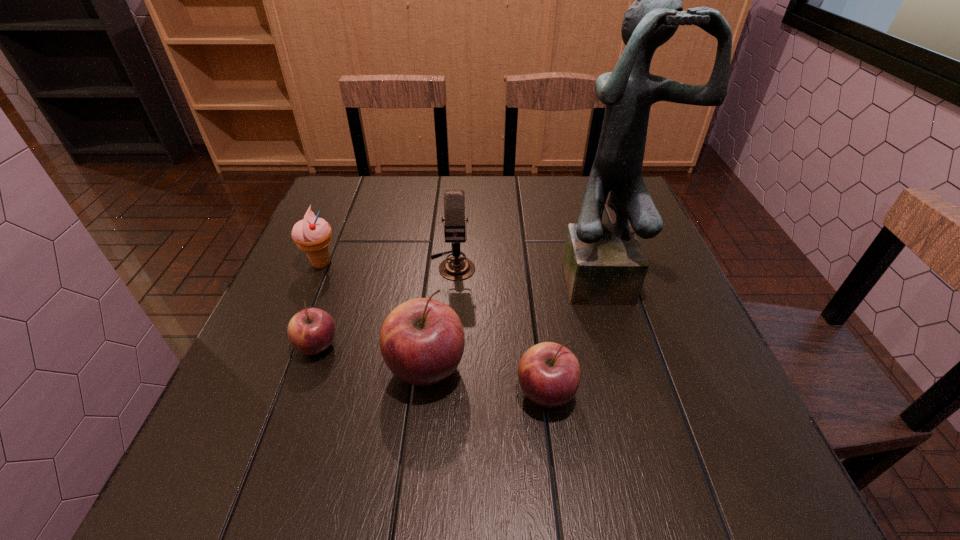
Please show where to add a apple on the right while keeping spacing even. Please provide its 2D coordinates. Your answer should be formatted as a tuple, i.e. [(x, y)], where the tuple contains the x and y coordinates of a point satisfying the conditions above.

[(678, 421)]